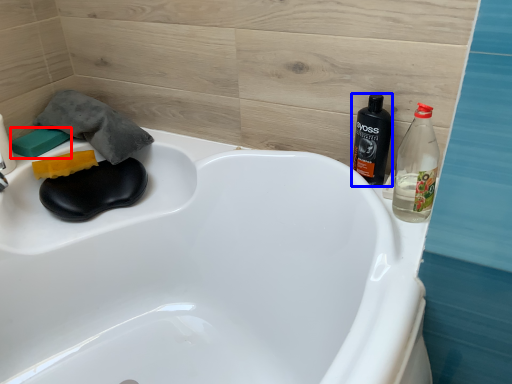
Question: Which object appears farthest to the camera in this image, soap (highlighted by a red box) or bottle (highlighted by a blue box)?

Choices:
 (A) soap
 (B) bottle

Answer: (A)